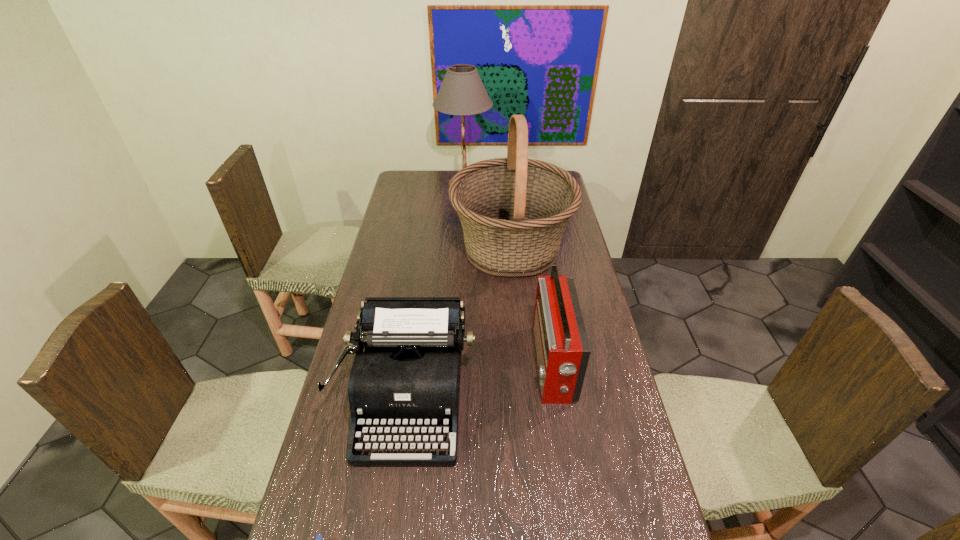
This screenshot has width=960, height=540. In order to click on object present at the far edge in this screenshot , I will do `click(462, 92)`.

Find the location of a particular element. This screenshot has width=960, height=540. object positioned at the left edge is located at coordinates (408, 377).

Locate an element on the screen. Image resolution: width=960 pixels, height=540 pixels. basket located at the right edge is located at coordinates (513, 211).

Locate an element on the screen. The width and height of the screenshot is (960, 540). radio receiver located at the right edge is located at coordinates (562, 348).

This screenshot has height=540, width=960. I want to click on free space at the left edge of the desktop, so click(x=353, y=536).

In the image, there is a desktop. Identify the location of free space at the right edge. The height and width of the screenshot is (540, 960). (643, 530).

You are a GUI agent. You are given a task and a screenshot of the screen. Output one action in this format:
    pyautogui.click(x=<x>, y=<y>)
    Task: Click on the free space at the far left corner of the desktop
    The width and height of the screenshot is (960, 540).
    Given the screenshot: What is the action you would take?
    pyautogui.click(x=419, y=172)

Locate an element on the screen. vacant area between the table lamp and the typewriter is located at coordinates (437, 290).

Locate an element on the screen. vacant area between the farthest object and the typewriter is located at coordinates (437, 290).

Point out which object is positioned as the second nearest to the second shortest object. Please provide its 2D coordinates. Your answer should be formatted as a tuple, i.e. [(x, y)], where the tuple contains the x and y coordinates of a point satisfying the conditions above.

[(562, 348)]